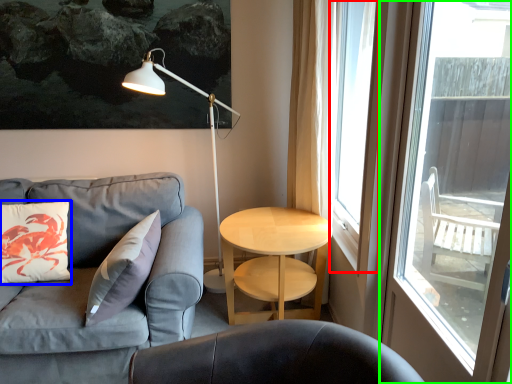
Question: Estimate the real-world distances between objects in this image. Which object is farther from window screen (highlighted by a red box), pillow (highlighted by a blue box) or window (highlighted by a green box)?

Choices:
 (A) pillow
 (B) window

Answer: (A)